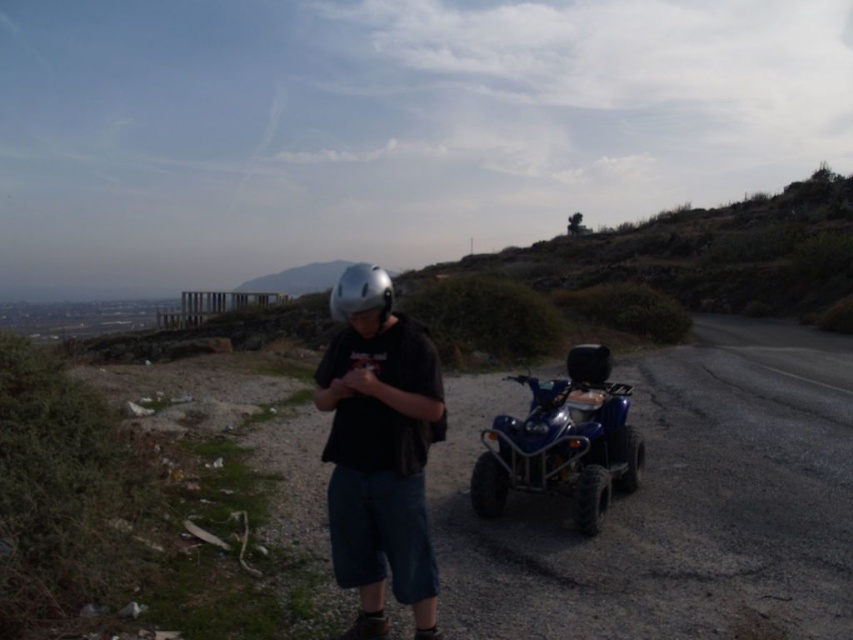
Is blue matte quad bike at right to the right of silver metallic helmet at center from the viewer's perspective?

Yes, blue matte quad bike at right is to the right of silver metallic helmet at center.

Which is above, blue matte quad bike at right or silver metallic helmet at center?

Positioned higher is silver metallic helmet at center.

Does point (589, 470) come closer to viewer compared to point (381, 268)?

Yes, it is in front of point (381, 268).

I want to click on blue matte quad bike at right, so click(x=563, y=442).

The height and width of the screenshot is (640, 853). I want to click on matte black helmet at center, so click(379, 451).

Is matte black helmet at center below silver metallic helmet at center?

Yes.

You are a GUI agent. You are given a task and a screenshot of the screen. Output one action in this format:
    pyautogui.click(x=<x>, y=<y>)
    Task: Click on the matte black helmet at center
    This screenshot has height=640, width=853.
    Given the screenshot: What is the action you would take?
    pyautogui.click(x=379, y=451)

Find the location of a particular element. matte black helmet at center is located at coordinates (379, 451).

Between matte black helmet at center and blue matte quad bike at right, which one is positioned lower?

Positioned lower is blue matte quad bike at right.

Which is in front, point (426, 522) or point (494, 508)?

Point (426, 522) is in front.

This screenshot has width=853, height=640. I want to click on matte black helmet at center, so click(x=379, y=451).